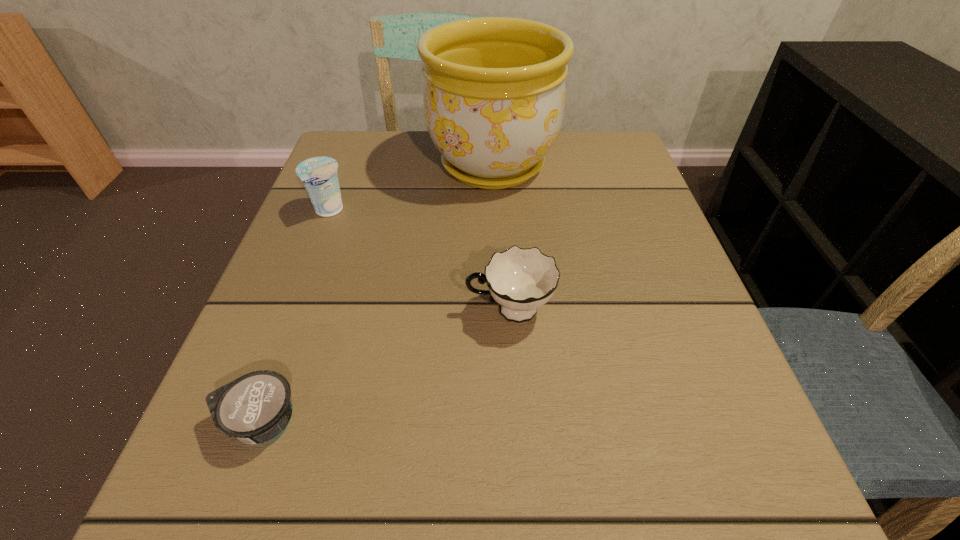
Locate an element on the screen. The image size is (960, 540). vacant space located on the back of the shorter yogurt is located at coordinates (308, 291).

What are the coordinates of `object that is at the far edge` in the screenshot? It's located at (494, 93).

I want to click on object positioned at the near edge, so click(x=255, y=408).

I want to click on object located at the near left corner, so click(255, 408).

Identify the location of vacant area at the far edge of the desktop. Image resolution: width=960 pixels, height=540 pixels. (400, 163).

Find the location of a particular element. vacant point at the near edge is located at coordinates (610, 507).

The height and width of the screenshot is (540, 960). In order to click on blank space at the left edge of the desktop in this screenshot , I will do `click(368, 244)`.

The width and height of the screenshot is (960, 540). In the image, there is a desktop. In order to click on free space at the right edge in this screenshot , I will do `click(689, 284)`.

In the image, there is a desktop. Identify the location of vacant space at the far left corner. The height and width of the screenshot is (540, 960). (373, 150).

Image resolution: width=960 pixels, height=540 pixels. Identify the location of vacant region at the near left corner of the desktop. (177, 481).